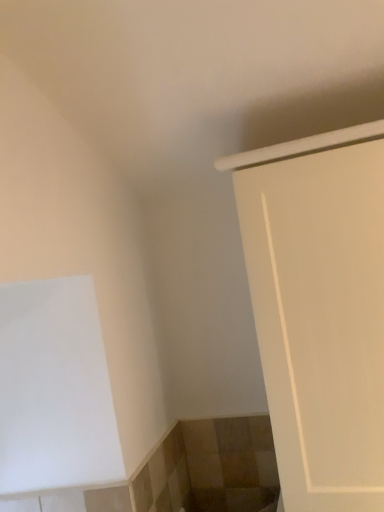
Locate an element on the screen. white wood door at upper right is located at coordinates (320, 318).

Describe the element at coordinates (320, 318) in the screenshot. Image resolution: width=384 pixels, height=512 pixels. I see `white wood door at upper right` at that location.

Measure the distance between white wood door at upper right and camera.

white wood door at upper right is 31.89 inches away from camera.

Where is `white wood door at upper right`? The width and height of the screenshot is (384, 512). white wood door at upper right is located at coordinates (320, 318).